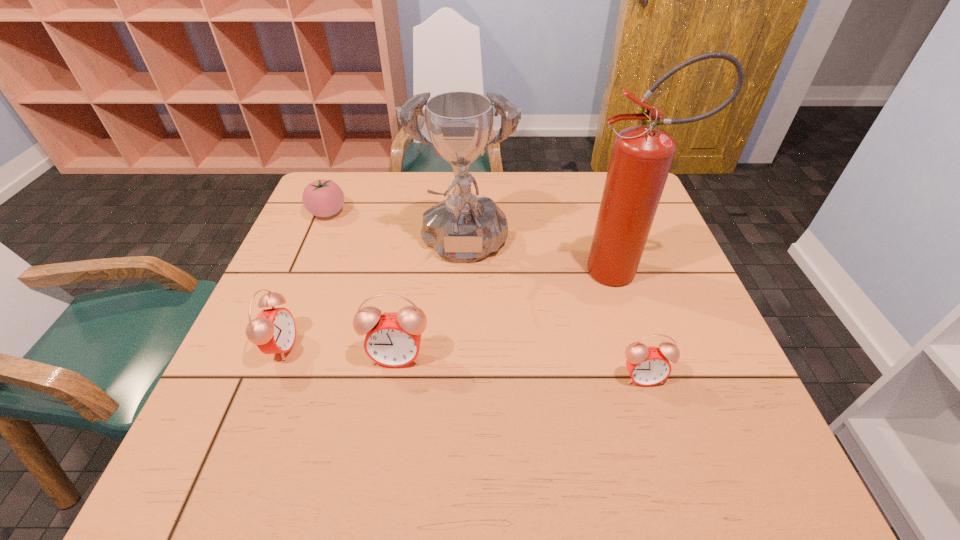
Where is `vacant area situated 0.150m from the nozzle of the fire extinguisher`? This screenshot has height=540, width=960. vacant area situated 0.150m from the nozzle of the fire extinguisher is located at coordinates (518, 271).

Find the location of a particular element. This screenshot has height=540, width=960. free space located from the nozzle of the fire extinguisher is located at coordinates (447, 271).

Find the location of a particular element. The image size is (960, 540). free spot located 0.180m from the nozzle of the fire extinguisher is located at coordinates (507, 271).

Identify the location of free space located 0.270m on the side with emblem of the award. (457, 383).

Locate an element on the screen. This screenshot has height=540, width=960. vacant space situated on the back of the shortest object is located at coordinates (341, 181).

Find the location of `object at the far edge`. object at the far edge is located at coordinates (323, 198).

The image size is (960, 540). In order to click on object present at the near edge in this screenshot , I will do `click(647, 365)`.

At what (x,y) coordinates should I click in order to perform the action: click on alarm clock present at the left edge. Please return your answer as a coordinate pair (x, y). Looking at the image, I should click on (273, 330).

Where is `tomato that is positioned at the left edge`? tomato that is positioned at the left edge is located at coordinates (323, 198).

Identify the location of alarm clock that is positioned at the right edge. (647, 365).